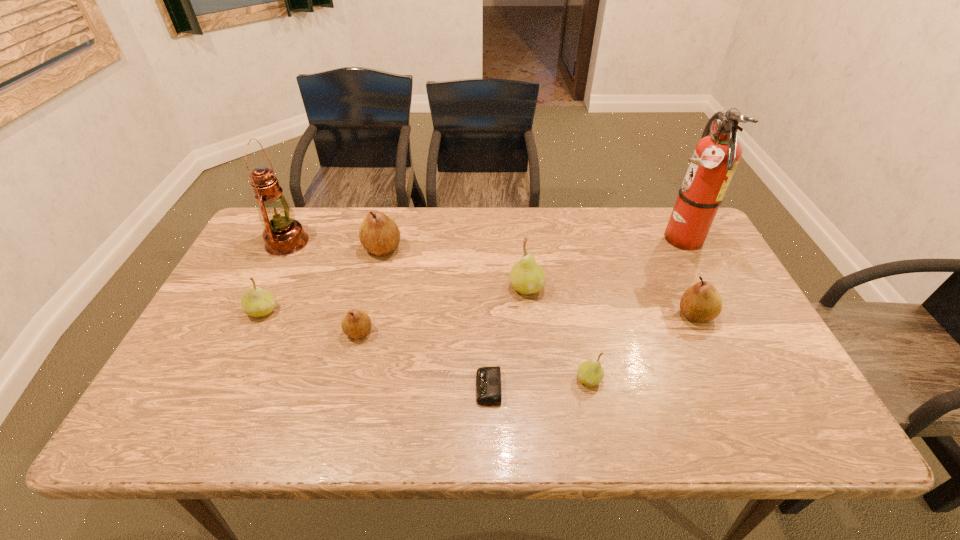
Locate an element on the screen. free area in between the fourth object from right to left and the rightmost pear is located at coordinates (611, 301).

Locate an element on the screen. This screenshot has width=960, height=540. vacant space that's between the shortest object and the second smallest green pear is located at coordinates (375, 349).

Where is `free space between the fourth object from right to left and the red fire extinguisher`? The image size is (960, 540). free space between the fourth object from right to left and the red fire extinguisher is located at coordinates click(x=602, y=263).

Where is `vacant area that lies between the nearest green pear and the second smallest green pear`? vacant area that lies between the nearest green pear and the second smallest green pear is located at coordinates (425, 345).

Locate an element on the screen. Image resolution: width=960 pixels, height=540 pixels. free space between the smallest brown pear and the oil lamp is located at coordinates (323, 287).

Identify which object is located as the sixth nearest to the red fire extinguisher. Please provide its 2D coordinates. Your answer should be formatted as a tuple, i.e. [(x, y)], where the tuple contains the x and y coordinates of a point satisfying the conditions above.

[(355, 323)]

Locate an element on the screen. the sixth closest object to the rightmost pear is located at coordinates (355, 323).

Identify which pear is located as the fourth nearest to the biggest brown pear. Please provide its 2D coordinates. Your answer should be formatted as a tuple, i.e. [(x, y)], where the tuple contains the x and y coordinates of a point satisfying the conditions above.

[(590, 373)]

Select which pear appears as the fourth closest to the sixth object from left to right. Please provide its 2D coordinates. Your answer should be formatted as a tuple, i.e. [(x, y)], where the tuple contains the x and y coordinates of a point satisfying the conditions above.

[(355, 323)]

Where is `brown pear that can be found as the second closest to the rightmost brown pear`? The height and width of the screenshot is (540, 960). brown pear that can be found as the second closest to the rightmost brown pear is located at coordinates pyautogui.click(x=355, y=323).